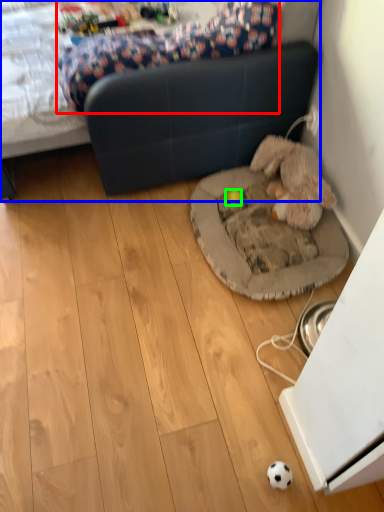
Question: Which is nearer to the mattress (highlighted by a red box)? studio couch (highlighted by a blue box) or toy (highlighted by a green box).

Choices:
 (A) studio couch
 (B) toy

Answer: (A)